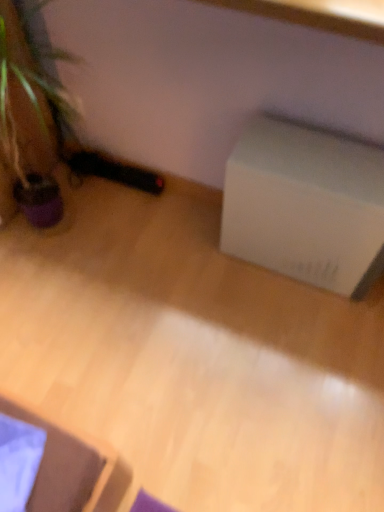
Where is `free space in front of white matte box at lower right`? Image resolution: width=384 pixels, height=512 pixels. free space in front of white matte box at lower right is located at coordinates (293, 339).